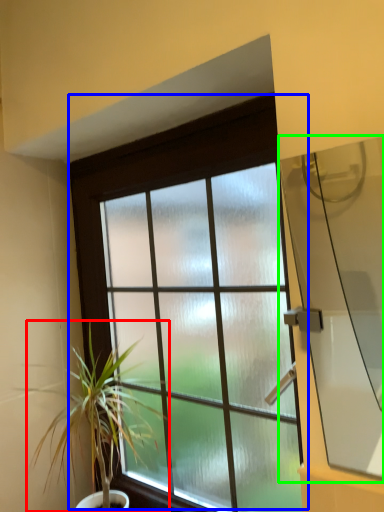
Question: Which is farther away from houseplant (highlighted by a red box)? window (highlighted by a blue box) or window screen (highlighted by a green box)?

Choices:
 (A) window
 (B) window screen

Answer: (B)